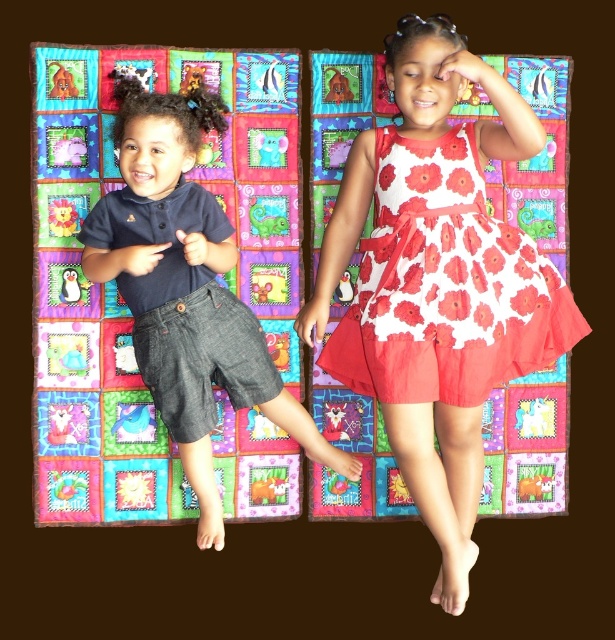
Question: Estimate the real-world distances between objects in this image. Which object is closer to the multicolored quilt at center?

Choices:
 (A) white floral fabric dress at center
 (B) denim shorts at left
 (C) white floral dress at center

Answer: (B)

Question: Can you confirm if white floral dress at center is positioned above denim shorts at left?

Choices:
 (A) no
 (B) yes

Answer: (A)

Question: Considering the real-world distances, which object is closest to the denim shorts at left?

Choices:
 (A) white floral fabric dress at center
 (B) multicolored quilt at center

Answer: (B)

Question: Can you confirm if white floral dress at center is positioned to the right of denim shorts at left?

Choices:
 (A) no
 (B) yes

Answer: (B)

Question: Which point is closer to the camera?

Choices:
 (A) multicolored quilt at center
 (B) denim shorts at left
 (C) white floral fabric dress at center

Answer: (B)

Question: Can you confirm if white floral dress at center is positioned to the right of denim shorts at left?

Choices:
 (A) yes
 (B) no

Answer: (A)